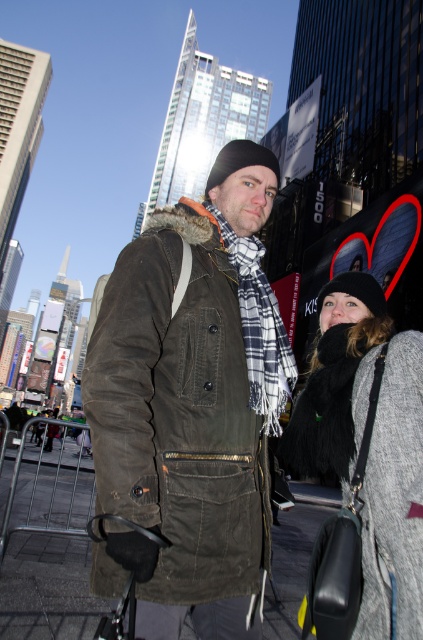
Between olive-green waxed canvas jacket at center and olive corduroy jacket at center, which one is positioned lower?

olive corduroy jacket at center is lower down.

Between olive-green waxed canvas jacket at center and olive corduroy jacket at center, which one appears on the left side from the viewer's perspective?

olive corduroy jacket at center is more to the left.

Between point (244, 456) and point (200, 592), which one is positioned behind?

Positioned behind is point (244, 456).

Find the location of a particular element. The image size is (423, 640). olive-green waxed canvas jacket at center is located at coordinates (x=189, y=404).

Does olive-green waxed canvas jacket at center appear on the right side of gray woolen sweater at right?

Incorrect, olive-green waxed canvas jacket at center is not on the right side of gray woolen sweater at right.

Between point (216, 470) and point (331, 573), which one is positioned in front?

Point (331, 573) is more forward.

Where is `olive-green waxed canvas jacket at center`? The height and width of the screenshot is (640, 423). olive-green waxed canvas jacket at center is located at coordinates [189, 404].

This screenshot has width=423, height=640. What do you see at coordinates (178, 412) in the screenshot?
I see `olive corduroy jacket at center` at bounding box center [178, 412].

Does olive corduroy jacket at center come behind gray woolen sweater at right?

No.

Is point (250, 488) positioned after point (320, 337)?

No.

Where is `olive corduroy jacket at center`? The width and height of the screenshot is (423, 640). olive corduroy jacket at center is located at coordinates (178, 412).